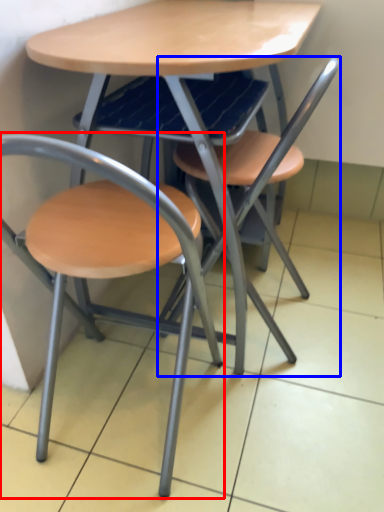
Question: Which point is closer to the camera, chair (highlighted by a red box) or chair (highlighted by a blue box)?

Choices:
 (A) chair
 (B) chair

Answer: (A)